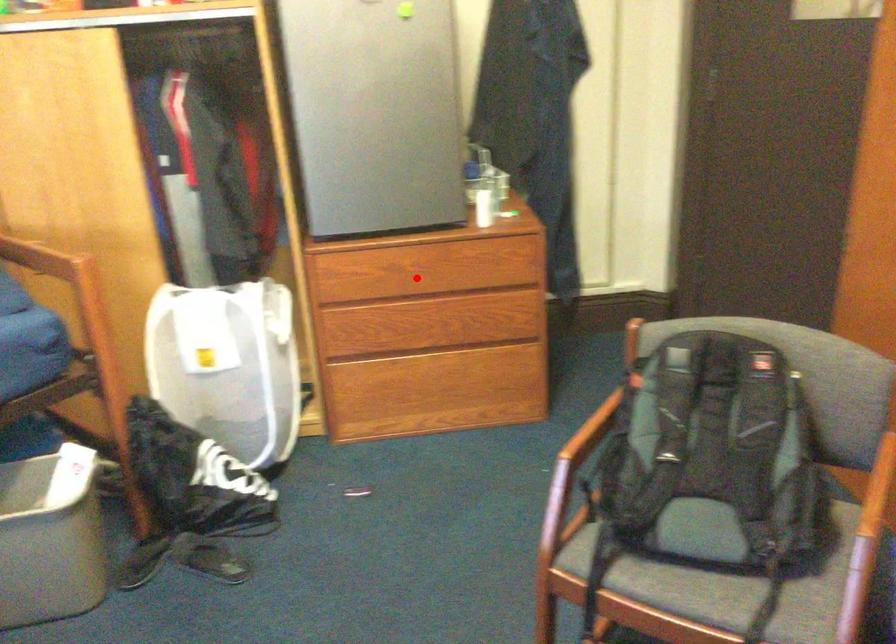
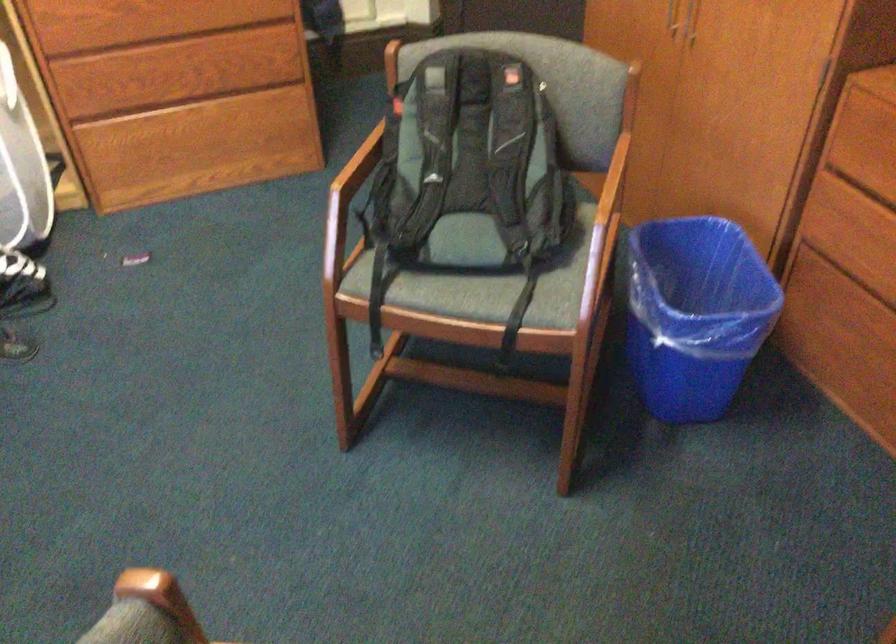
The point at the highlighted location is marked in the first image. Where is the corresponding point in the second image?

(160, 20)